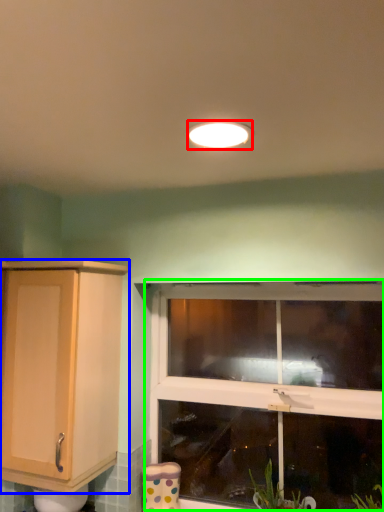
Question: Which is farther away from light fixture (highlighted by a red box)? cabinetry (highlighted by a blue box) or window (highlighted by a green box)?

Choices:
 (A) cabinetry
 (B) window

Answer: (B)